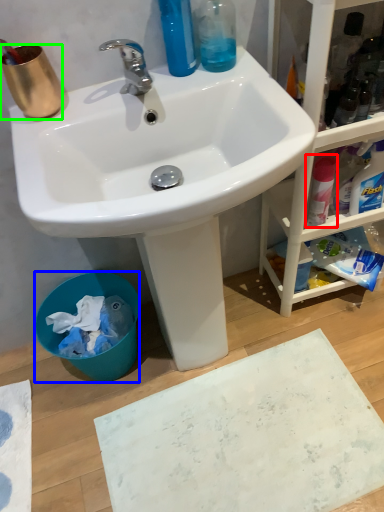
Question: Which object is the closest to the cleaning product (highlighted by a red box)? Choose among these: trash bin/can (highlighted by a blue box) or coffee cup (highlighted by a green box).

Choices:
 (A) trash bin/can
 (B) coffee cup

Answer: (B)